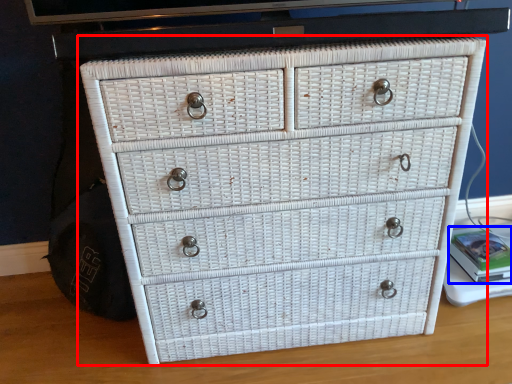
Question: Which of the following is the closest to the observer, chest of drawers (highlighted by a red box) or book (highlighted by a blue box)?

Choices:
 (A) chest of drawers
 (B) book

Answer: (A)